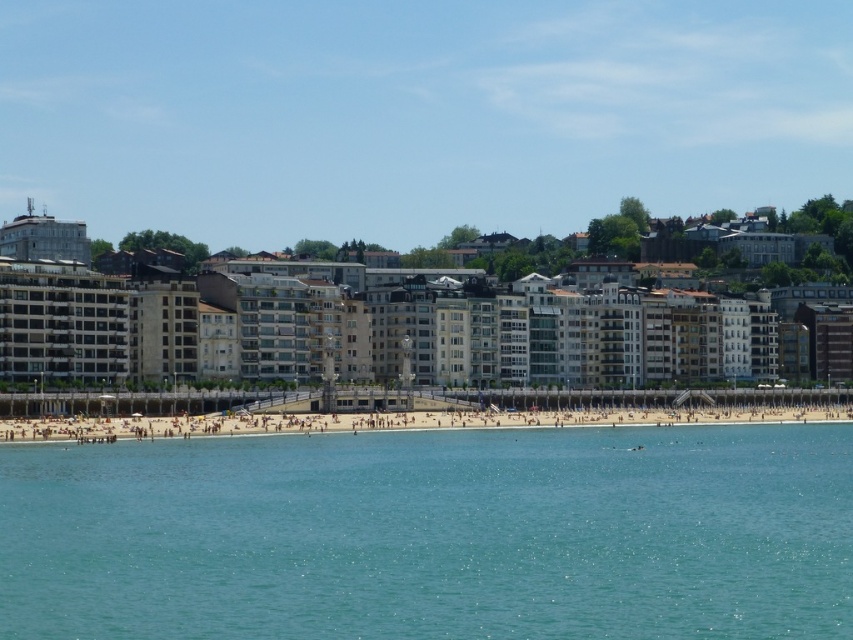
You are a tourist standing on the beach and want to take a photo of both the clear blue water at beach center and the beige stone building at center. Which object should you focus on first if you want to capture both in the same frame without moving your camera?

You should focus on the beige stone building at center first because it is taller than the clear blue water at beach center, so adjusting the camera angle to include its full height will naturally include the shorter water area in the frame.

You are standing on the beach and want to reach the clear blue water at beach center. Which direction should you move relative to the light brown sand at center?

You should move downward towards the clear blue water at beach center since it is located below the light brown sand at center.

You are standing on the light brown sand at center and want to walk towards the beige stone building at center. Which direction should you face?

You should face to the right because the beige stone building at center is to the left of light brown sand at center, so facing right will allow you to walk towards it.